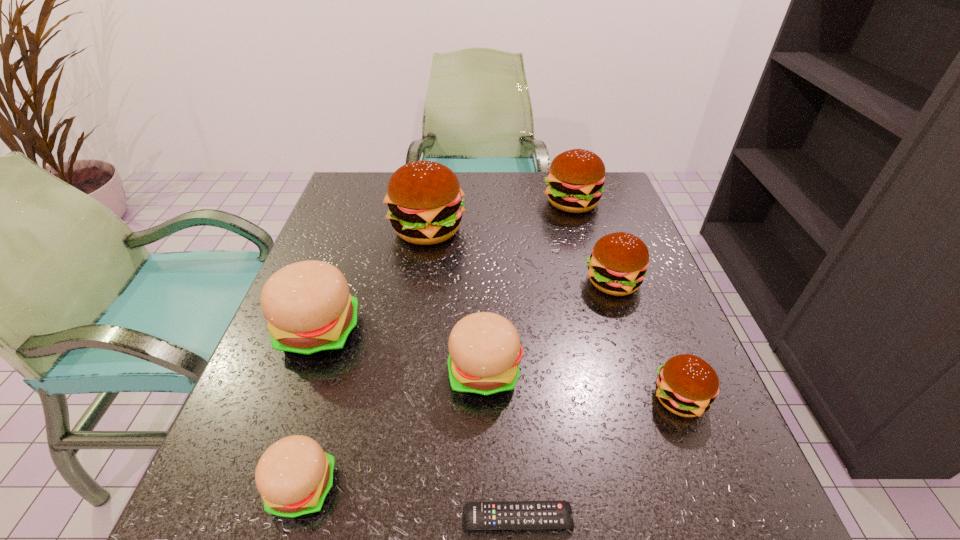
You are a GUI agent. You are given a task and a screenshot of the screen. Output one action in this format:
    pyautogui.click(x=<x>, y=<y>)
    Task: Click on the black remote control
    The height and width of the screenshot is (540, 960).
    Given the screenshot: What is the action you would take?
    pyautogui.click(x=504, y=515)

In order to click on the shortest object in this screenshot , I will do `click(504, 515)`.

At what (x,y) coordinates should I click in order to perform the action: click on free region located 0.250m on the front of the biggest brown hamburger. Please return your answer as a coordinate pair (x, y). Looking at the image, I should click on (412, 335).

I want to click on vacant region located 0.330m on the front of the second biggest brown hamburger, so click(x=603, y=310).

Image resolution: width=960 pixels, height=540 pixels. I want to click on vacant area situated 0.300m on the right of the biggest beige hamburger, so click(513, 332).

Identify the location of vacant area situated on the back of the second smallest brown hamburger. The height and width of the screenshot is (540, 960). (600, 242).

The height and width of the screenshot is (540, 960). In order to click on vacant space located on the left of the rightmost beige hamburger in this screenshot , I will do `click(321, 373)`.

Identify the location of vacant area located 0.290m on the back of the nearest brown hamburger. click(x=630, y=269).

Locate an element on the screen. free location located 0.190m on the right of the smallest beige hamburger is located at coordinates (466, 488).

This screenshot has height=540, width=960. I want to click on vacant area situated 0.230m on the right of the shortest object, so click(x=738, y=518).